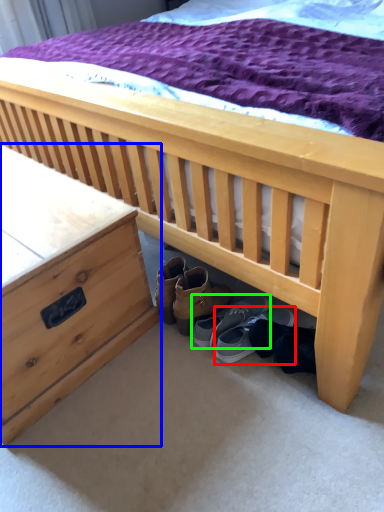
Question: Considering the real-world distances, which object is farthest from footwear (highlighted by a red box)? nightstand (highlighted by a blue box) or footwear (highlighted by a green box)?

Choices:
 (A) nightstand
 (B) footwear

Answer: (A)